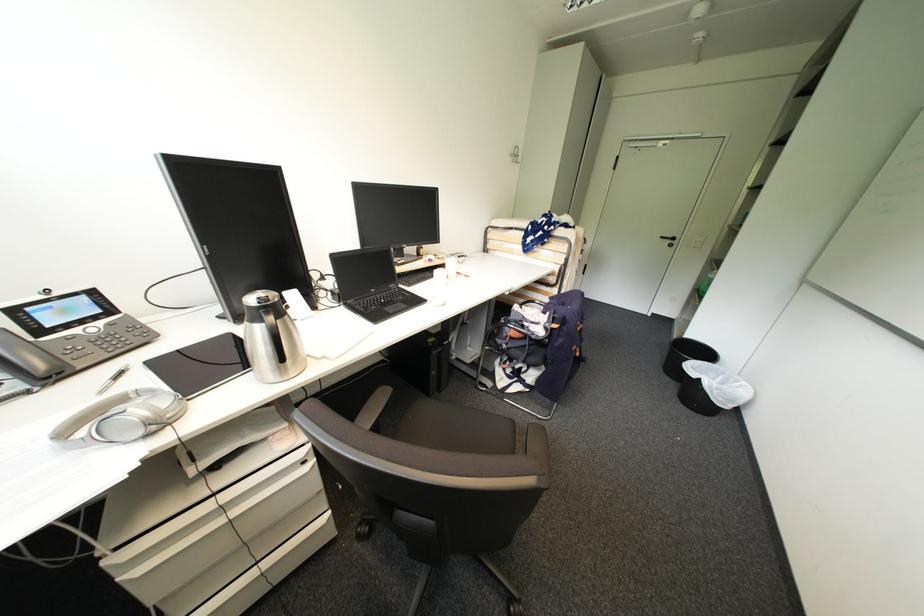
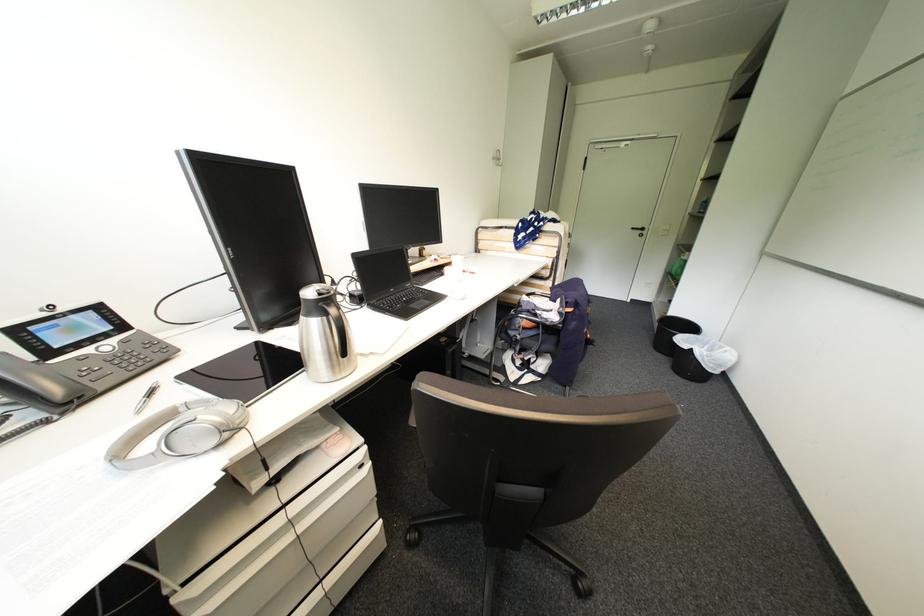
The point at (39, 373) is marked in the first image. Where is the corresponding point in the second image?

(56, 399)